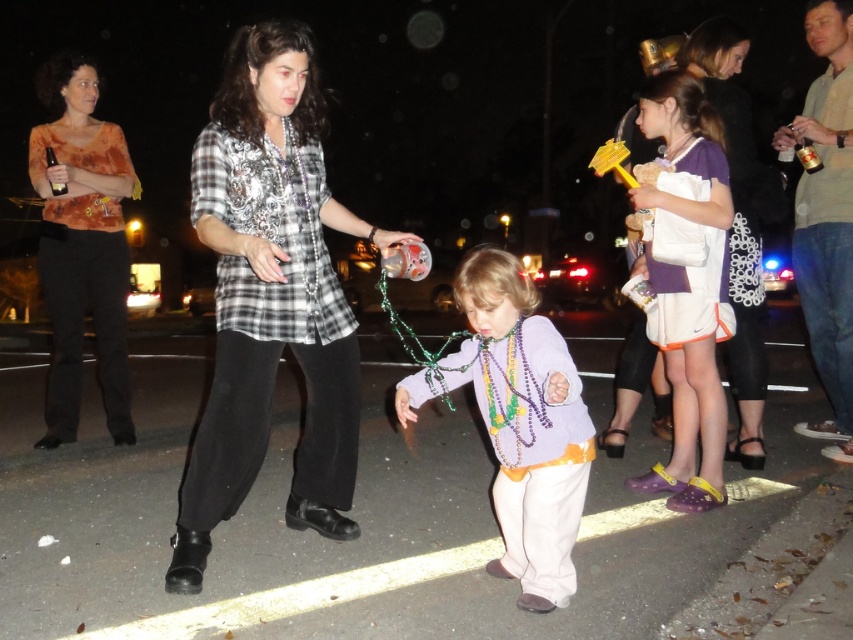
Is plaid shirt at center wider than purple matte shirt at center?

Yes, plaid shirt at center is wider than purple matte shirt at center.

Can you confirm if plaid shirt at center is smaller than purple matte shirt at center?

No.

Locate an element on the screen. The height and width of the screenshot is (640, 853). plaid shirt at center is located at coordinates (270, 296).

Locate an element on the screen. plaid shirt at center is located at coordinates (270, 296).

Does point (293, 28) lie behind point (683, 316)?

No, it is not.

At what (x,y) coordinates should I click in order to perform the action: click on plaid shirt at center. Please return your answer as a coordinate pair (x, y). The width and height of the screenshot is (853, 640). Looking at the image, I should click on (270, 296).

The height and width of the screenshot is (640, 853). Describe the element at coordinates (270, 296) in the screenshot. I see `plaid shirt at center` at that location.

This screenshot has width=853, height=640. Find the location of `plaid shirt at center`. plaid shirt at center is located at coordinates (270, 296).

Can you confirm if plaid shirt at center is thinner than orange floral shirt at left?

No, plaid shirt at center is not thinner than orange floral shirt at left.

Does point (172, 592) come behind point (109, 209)?

No, (172, 592) is closer to viewer.

The width and height of the screenshot is (853, 640). I want to click on plaid shirt at center, so click(270, 296).